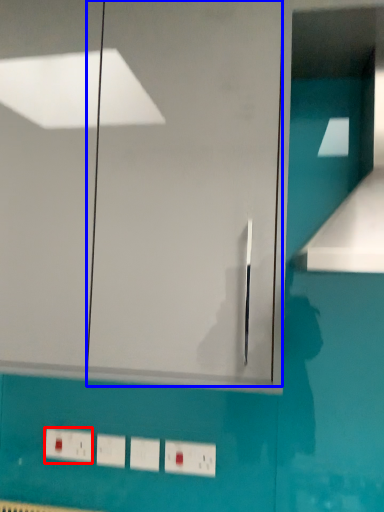
Question: Among these objects, which one is farthest to the camera, electric outlet (highlighted by a red box) or glass door (highlighted by a blue box)?

Choices:
 (A) electric outlet
 (B) glass door

Answer: (A)